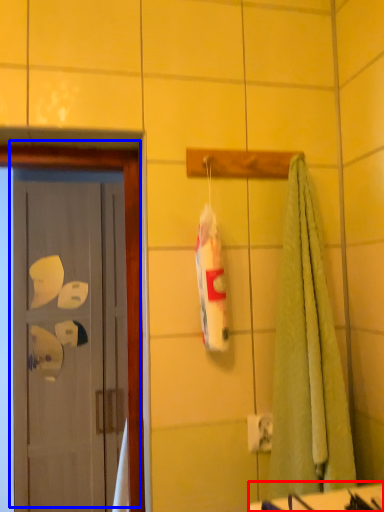
Question: Among these objects, which one is farthest to the camera, counter top (highlighted by a red box) or door (highlighted by a blue box)?

Choices:
 (A) counter top
 (B) door

Answer: (B)